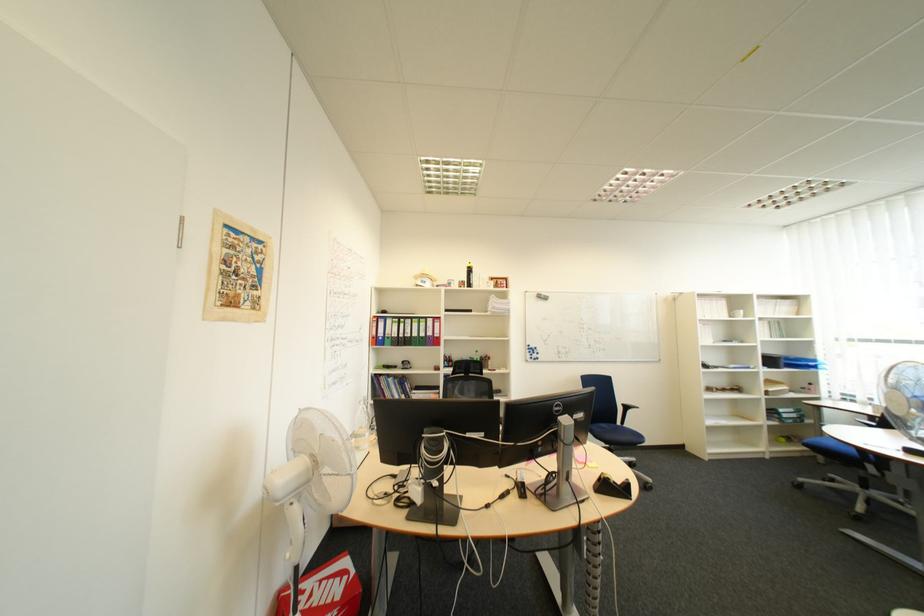
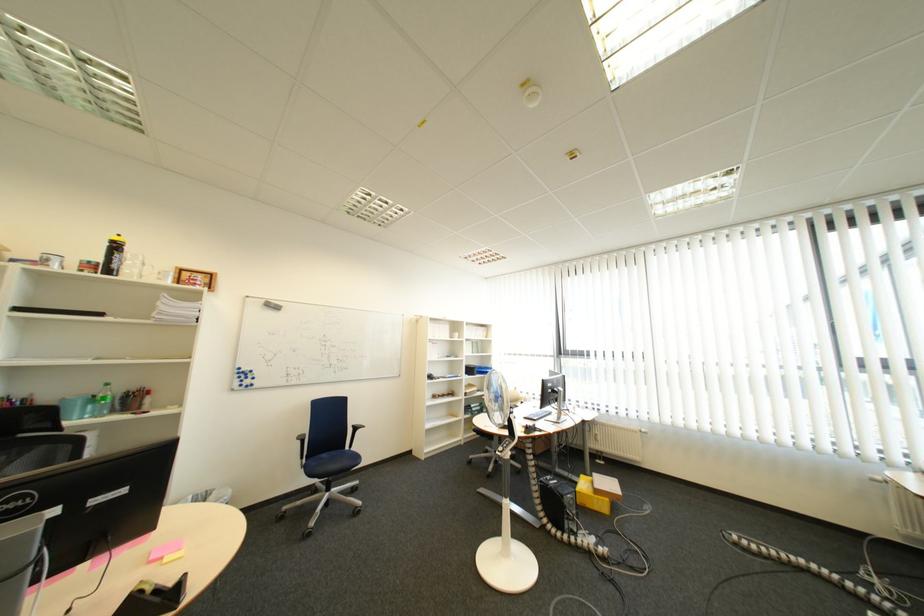
Question: The first image is from the beginning of the video and the second image is from the end. How did the camera likely rotate when shooting the video?

Choices:
 (A) Left
 (B) Right
 (C) Up
 (D) Down

Answer: (B)